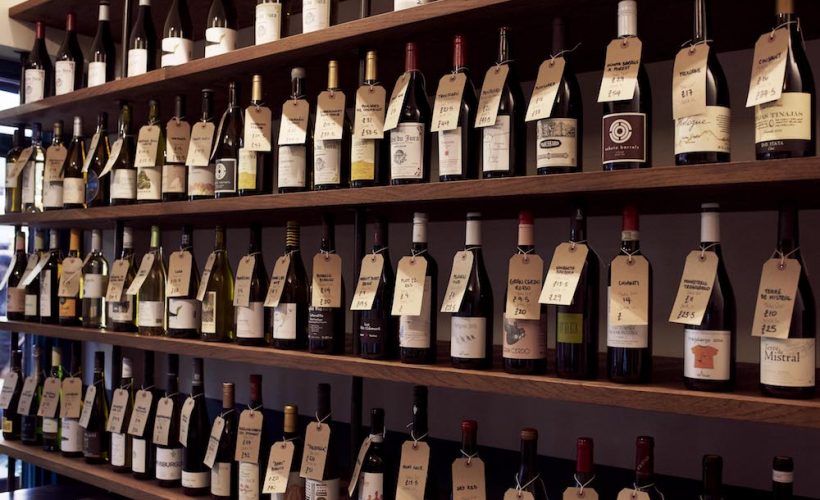
Locate an element on the screen. long wooden shelves is located at coordinates (213, 57), (201, 207), (184, 345), (106, 475), (34, 489), (20, 9).